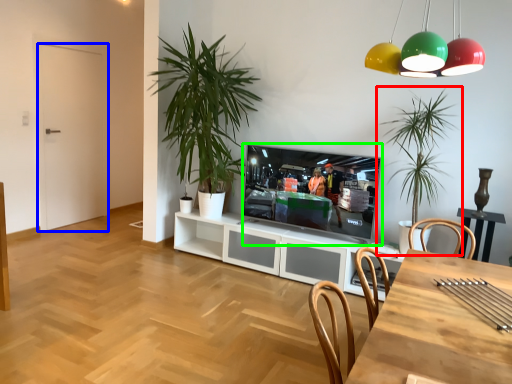
Question: Which object is positioned farthest from houseplant (highlighted by a red box)? Select from door (highlighted by a blue box) and television (highlighted by a green box).

Choices:
 (A) door
 (B) television

Answer: (A)